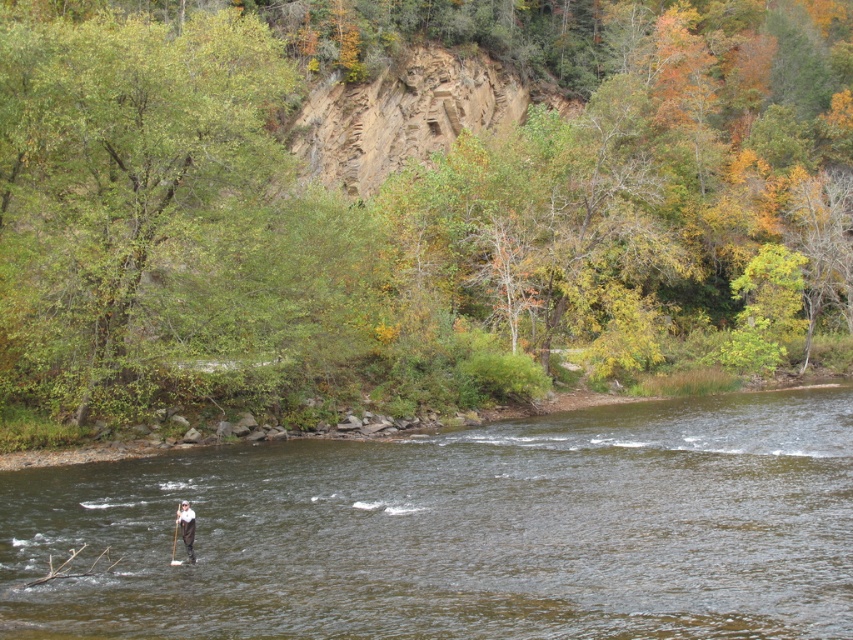
Which of these two, dark gray fabric person at center or wooden paddle at center, stands taller?

wooden paddle at center

Between dark gray fabric person at center and wooden paddle at center, which one is positioned higher?

dark gray fabric person at center

This screenshot has height=640, width=853. I want to click on dark gray fabric person at center, so click(186, 528).

This screenshot has height=640, width=853. Find the location of `dark gray fabric person at center`. dark gray fabric person at center is located at coordinates (186, 528).

Does green leafy tree at upper center appear on the right side of wooden paddle at center?

Yes, green leafy tree at upper center is to the right of wooden paddle at center.

At what (x,y) coordinates should I click in order to perform the action: click on green leafy tree at upper center. Please return your answer as a coordinate pair (x, y). Looking at the image, I should click on (405, 200).

Which is in front, point (171, 150) or point (173, 547)?

Point (173, 547) is in front.

Where is `green leafy tree at upper center`? The image size is (853, 640). green leafy tree at upper center is located at coordinates (405, 200).

Is brown water at center wider than wooden paddle at center?

Yes, brown water at center is wider than wooden paddle at center.

How far apart are brown water at center and wooden paddle at center?

brown water at center and wooden paddle at center are 8.50 meters apart.

This screenshot has height=640, width=853. Describe the element at coordinates (465, 531) in the screenshot. I see `brown water at center` at that location.

Where is `brown water at center`? The width and height of the screenshot is (853, 640). brown water at center is located at coordinates (465, 531).